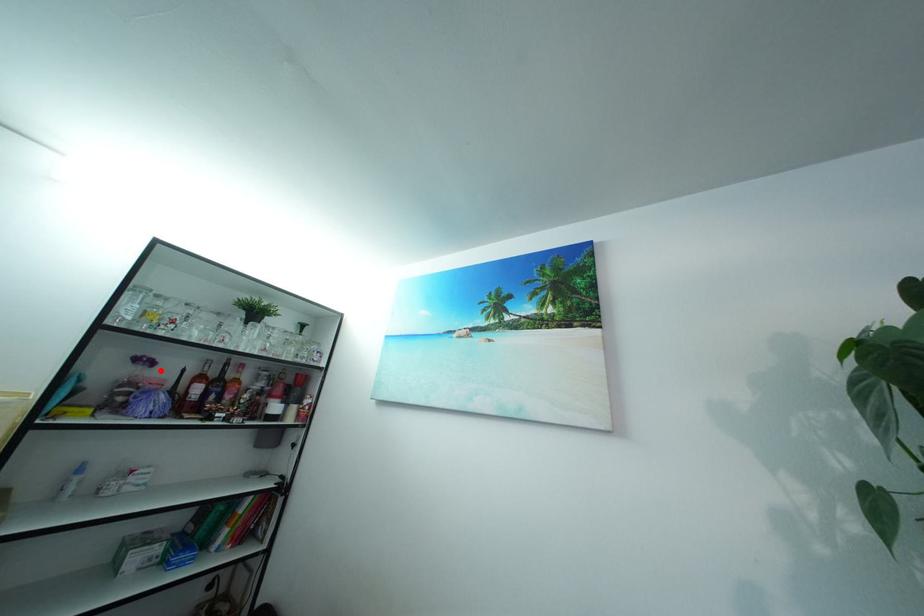
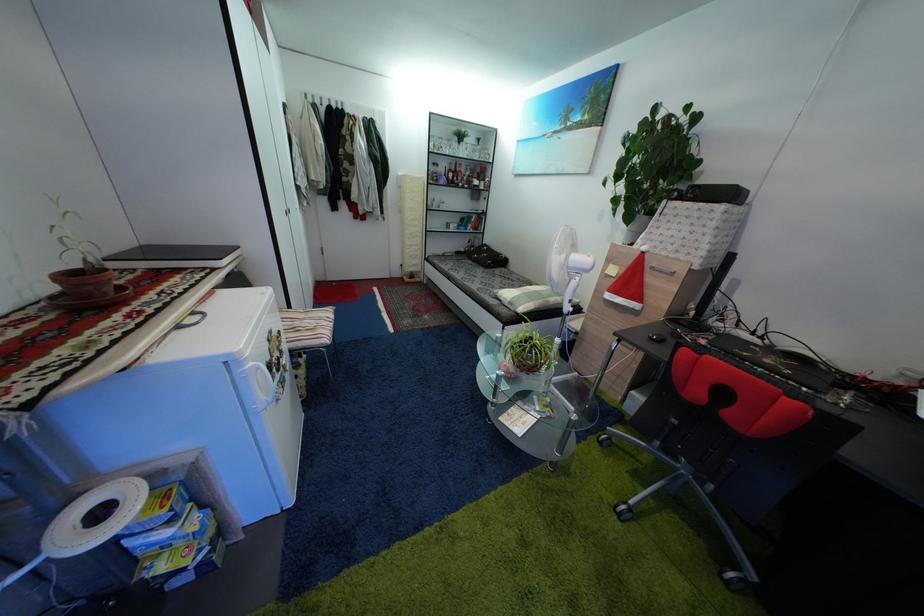
Question: I am providing you with two images of the same scene from different viewpoints. Image1 has a red point marked. In image2, the corresponding 3D location appears at what relative position? Reply with the corresponding letter.

Choices:
 (A) Closer
 (B) Farther

Answer: (A)